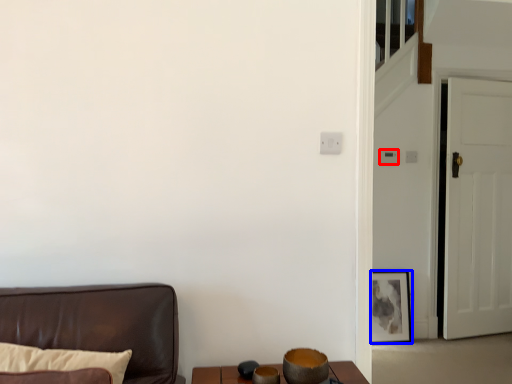
Question: Among these objects, which one is nearest to the camera, light switch (highlighted by a red box) or picture frame (highlighted by a blue box)?

Choices:
 (A) light switch
 (B) picture frame

Answer: (B)